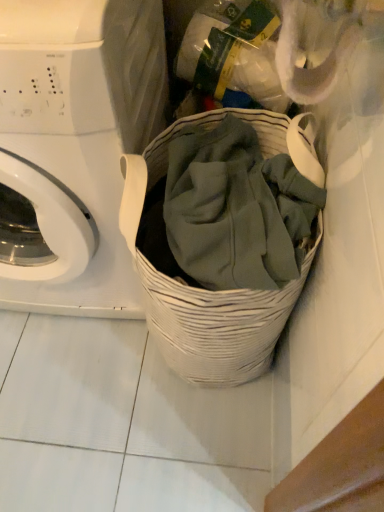
Question: Can you confirm if white woven basket at center is shorter than white glossy washing machine at left?

Choices:
 (A) yes
 (B) no

Answer: (A)

Question: Is white woven basket at center further to camera compared to white glossy washing machine at left?

Choices:
 (A) yes
 (B) no

Answer: (A)

Question: Is white woven basket at center not within white glossy washing machine at left?

Choices:
 (A) no
 (B) yes

Answer: (B)

Question: From the image's perspective, is white woven basket at center below white glossy washing machine at left?

Choices:
 (A) yes
 (B) no

Answer: (A)

Question: Is white woven basket at center facing towards white glossy washing machine at left?

Choices:
 (A) yes
 (B) no

Answer: (B)

Question: Can you confirm if white woven basket at center is taller than white glossy washing machine at left?

Choices:
 (A) no
 (B) yes

Answer: (A)

Question: Does white glossy washing machine at left have a greater width compared to white woven basket at center?

Choices:
 (A) no
 (B) yes

Answer: (B)

Question: Considering the relative sizes of white glossy washing machine at left and white woven basket at center in the image provided, is white glossy washing machine at left taller than white woven basket at center?

Choices:
 (A) no
 (B) yes

Answer: (B)

Question: Is white glossy washing machine at left oriented towards white woven basket at center?

Choices:
 (A) yes
 (B) no

Answer: (B)

Question: Is white glossy washing machine at left closer to camera compared to white woven basket at center?

Choices:
 (A) no
 (B) yes

Answer: (B)

Question: Does white glossy washing machine at left appear on the left side of white woven basket at center?

Choices:
 (A) no
 (B) yes

Answer: (B)

Question: Considering the relative sizes of white glossy washing machine at left and white woven basket at center in the image provided, is white glossy washing machine at left smaller than white woven basket at center?

Choices:
 (A) yes
 (B) no

Answer: (B)

Question: Considering the relative positions of white glossy washing machine at left and white woven basket at center in the image provided, is white glossy washing machine at left to the left or to the right of white woven basket at center?

Choices:
 (A) left
 (B) right

Answer: (A)